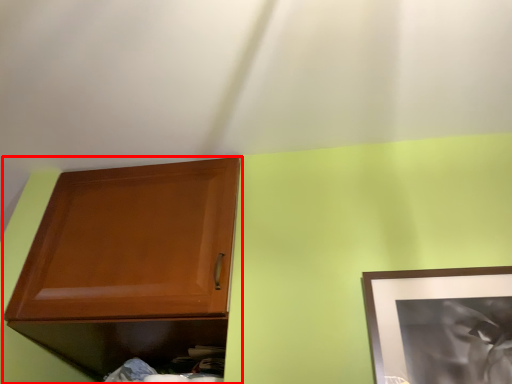
Question: In this image, where is cabinetry (annotated by the red box) located relative to picture frame?

Choices:
 (A) right
 (B) left

Answer: (B)